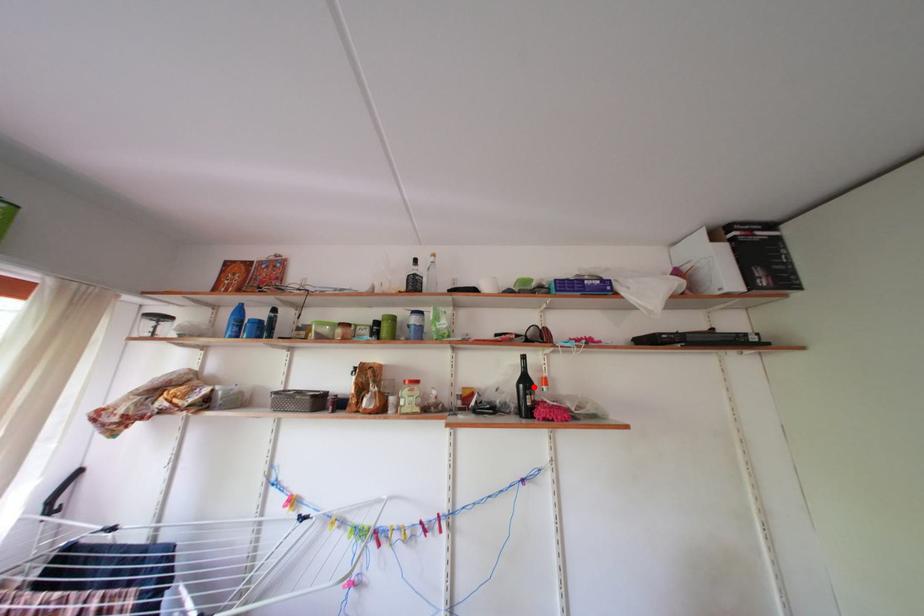
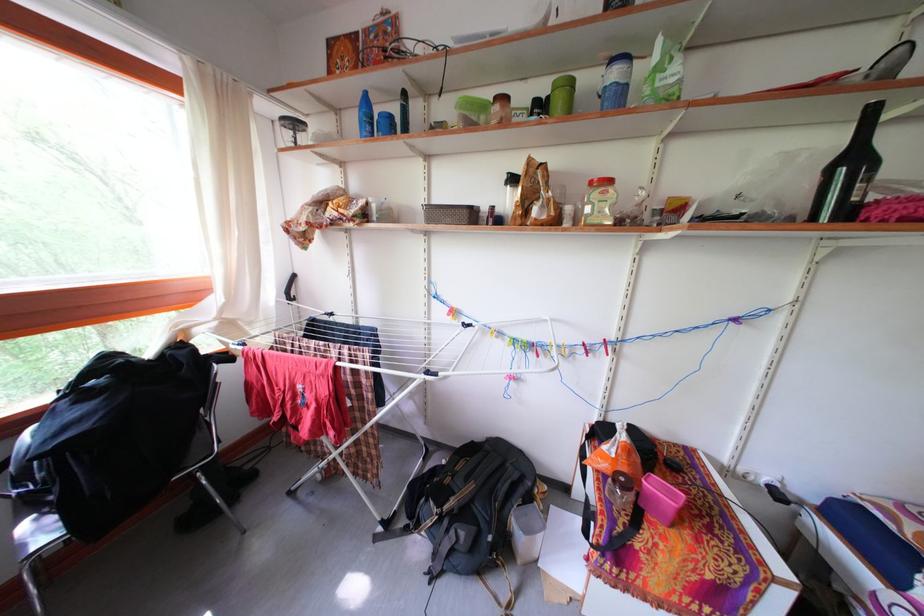
In the second image, find the point that corresponds to the highlighted location in the first image.

(861, 166)